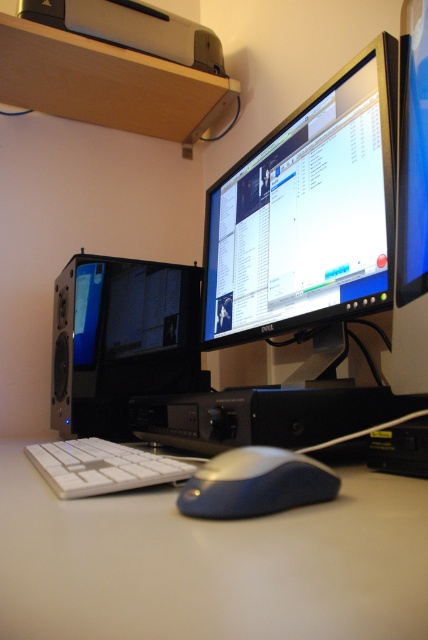
You are organizing your desk and want to place a new wireless charger that is 12 centimeters wide. You have space between the white plastic table at lower center and the white matte keyboard at lower center. Will the charger fit in that space?

The distance between the white plastic table at lower center and the white matte keyboard at lower center is 13.09 centimeters. Since the wireless charger is 12 centimeters wide, it will fit in the space between them.

You are a graphic designer working on a project and need to locate your black glossy monitor at center. According to the coordinates provided, where should you look on your desk?

The black glossy monitor at center is located at coordinates point (308, 211).

You are organizing your workspace and need to place a new item on the white plastic table at lower center. Based on its position, where exactly on the table should you place it?

The white plastic table at lower center is located at point coordinates, so you should place the new item at the specified coordinates to ensure proper positioning.